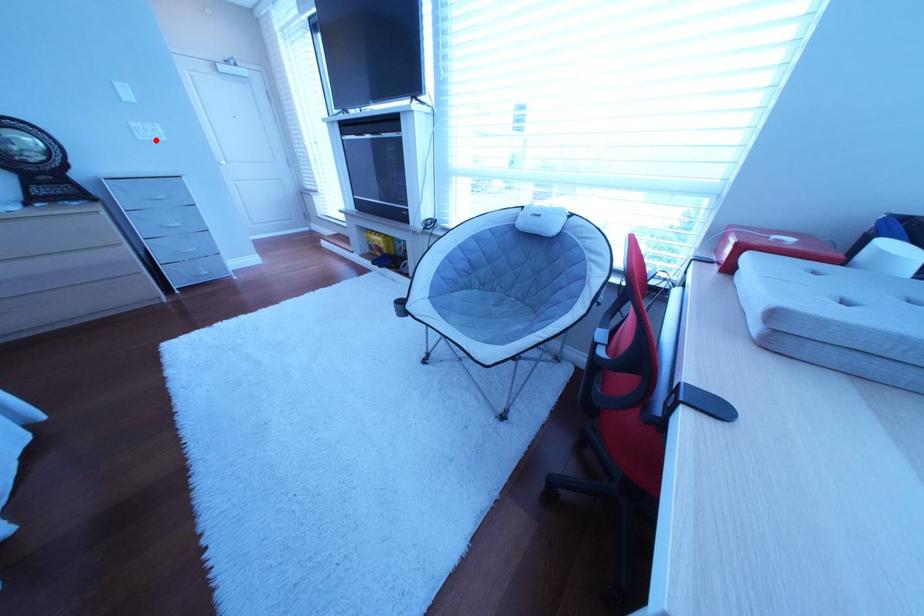
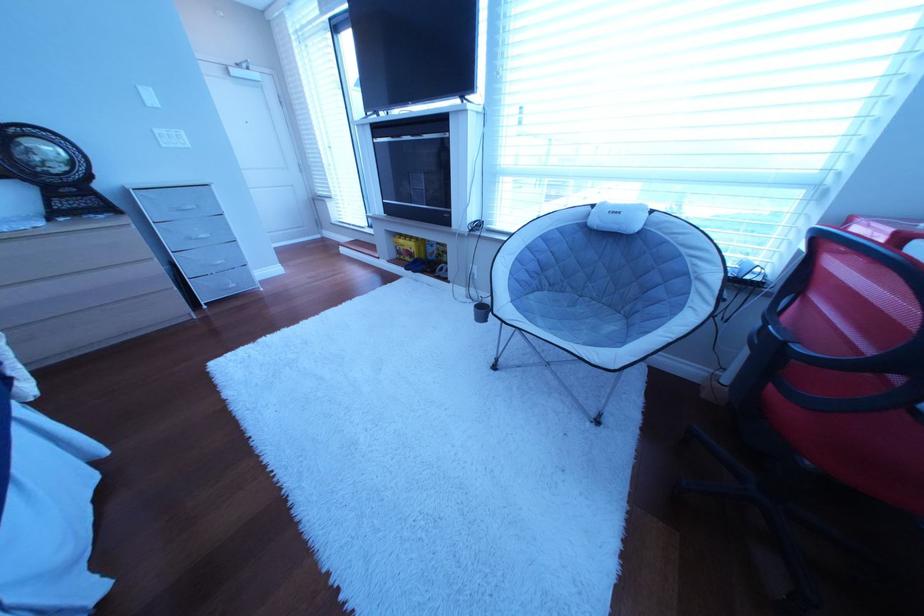
Question: I am providing you with two images of the same scene from different viewpoints. A red point is marked on the first image. Is the red point's position out of view in image 2?

Choices:
 (A) Yes
 (B) No

Answer: (B)